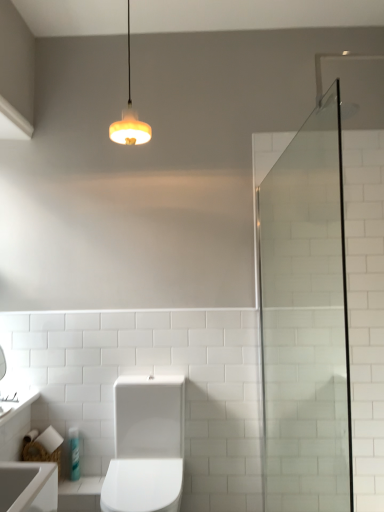
I want to click on white glossy sink at lower left, so click(19, 404).

What is the approximate width of clear glass shower door at right?

1.45 meters.

What do you see at coordinates (74, 454) in the screenshot? The width and height of the screenshot is (384, 512). I see `translucent plastic bottle at lower left` at bounding box center [74, 454].

Where is `matte yellow glass pendant light at upper center`? matte yellow glass pendant light at upper center is located at coordinates (130, 117).

Considering the positions of objects clear glass shower door at right and translucent plastic bottle at lower left in the image provided, who is more to the right, clear glass shower door at right or translucent plastic bottle at lower left?

Positioned to the right is clear glass shower door at right.

Who is taller, clear glass shower door at right or translucent plastic bottle at lower left?

Standing taller between the two is clear glass shower door at right.

Is translucent plastic bottle at lower left at the back of clear glass shower door at right?

No, clear glass shower door at right's orientation is not away from translucent plastic bottle at lower left.

Measure the distance from clear glass shower door at right to translucent plastic bottle at lower left.

clear glass shower door at right and translucent plastic bottle at lower left are 1.42 meters apart.

Is the surface of matte yellow glass pendant light at upper center in direct contact with white glossy toilet at center?

No, matte yellow glass pendant light at upper center is not making contact with white glossy toilet at center.

From a real-world perspective, is matte yellow glass pendant light at upper center physically located above or below white glossy toilet at center?

matte yellow glass pendant light at upper center is above white glossy toilet at center.

From the image's perspective, would you say matte yellow glass pendant light at upper center is shown under white glossy toilet at center?

No, from the image's perspective, matte yellow glass pendant light at upper center is not below white glossy toilet at center.

Where is `light fixture behind the white glossy toilet at center`? The image size is (384, 512). light fixture behind the white glossy toilet at center is located at coordinates (130, 117).

In the image, is matte yellow glass pendant light at upper center positioned in front of or behind clear glass shower door at right?

matte yellow glass pendant light at upper center is behind clear glass shower door at right.

Is matte yellow glass pendant light at upper center not near clear glass shower door at right?

matte yellow glass pendant light at upper center is positioned a significant distance from clear glass shower door at right.

Can you tell me how much matte yellow glass pendant light at upper center and clear glass shower door at right differ in facing direction?

0.273 degrees separate the facing orientations of matte yellow glass pendant light at upper center and clear glass shower door at right.

Is matte yellow glass pendant light at upper center facing towards clear glass shower door at right?

No, matte yellow glass pendant light at upper center is not oriented towards clear glass shower door at right.

Would you say white glossy toilet at center is a long distance from white glossy sink at lower left?

white glossy toilet at center is near white glossy sink at lower left, not far away.

Looking at this image, is white glossy toilet at center outside of white glossy sink at lower left?

white glossy toilet at center lies outside white glossy sink at lower left's area.

Between white glossy toilet at center and white glossy sink at lower left, which one has more height?

white glossy toilet at center is taller.

From the image's perspective, is white glossy toilet at center located beneath white glossy sink at lower left?

Answer: Correct, white glossy toilet at center appears lower than white glossy sink at lower left in the image.

Who is shorter, translucent plastic bottle at lower left or white glossy toilet at center?

With less height is translucent plastic bottle at lower left.

Is translucent plastic bottle at lower left positioned with its back to white glossy toilet at center?

That's not correct — translucent plastic bottle at lower left is not looking away from white glossy toilet at center.

Where is `toiletry behind the white glossy toilet at center`? Image resolution: width=384 pixels, height=512 pixels. toiletry behind the white glossy toilet at center is located at coordinates (74, 454).

Is translucent plastic bottle at lower left to the left of white glossy toilet at center from the viewer's perspective?

Yes.

Identify the location of screen door on the right of white glossy toilet at center. Image resolution: width=384 pixels, height=512 pixels. (306, 321).

Can you tell me how much white glossy toilet at center and clear glass shower door at right differ in facing direction?

There is a 1.71-degree angle between the facing directions of white glossy toilet at center and clear glass shower door at right.

Based on the photo, considering the sizes of objects white glossy toilet at center and clear glass shower door at right in the image provided, who is smaller, white glossy toilet at center or clear glass shower door at right?

clear glass shower door at right.

Is point (75, 469) positioned after point (324, 279)?

No, (75, 469) is in front of (324, 279).

Considering the sizes of translucent plastic bottle at lower left and clear glass shower door at right in the image, is translucent plastic bottle at lower left taller or shorter than clear glass shower door at right?

Clearly, translucent plastic bottle at lower left is shorter compared to clear glass shower door at right.

How many degrees apart are the facing directions of translucent plastic bottle at lower left and clear glass shower door at right?

There is a 2.39-degree angle between the facing directions of translucent plastic bottle at lower left and clear glass shower door at right.

Based on the photo, from the image's perspective, is translucent plastic bottle at lower left under clear glass shower door at right?

Yes.

At what (x,y) coordinates should I click in order to perform the action: click on screen door above the translucent plastic bottle at lower left (from the image's perspective). Please return your answer as a coordinate pair (x, y). The image size is (384, 512). Looking at the image, I should click on (306, 321).

The width and height of the screenshot is (384, 512). In order to click on toilet below the matte yellow glass pendant light at upper center (from a real-world perspective) in this screenshot , I will do `click(146, 445)`.

From the image, which object appears to be nearer to translucent plastic bottle at lower left, matte yellow glass pendant light at upper center or white glossy toilet at center?

Among the two, white glossy toilet at center is located nearer to translucent plastic bottle at lower left.

From the image, which object appears to be nearer to matte yellow glass pendant light at upper center, white glossy sink at lower left or translucent plastic bottle at lower left?

Based on the image, white glossy sink at lower left appears to be nearer to matte yellow glass pendant light at upper center.

Estimate the real-world distances between objects in this image. Which object is closer to clear glass shower door at right, matte yellow glass pendant light at upper center or translucent plastic bottle at lower left?

The object closer to clear glass shower door at right is matte yellow glass pendant light at upper center.

Looking at the image, which one is located further to translucent plastic bottle at lower left, white glossy sink at lower left or clear glass shower door at right?

clear glass shower door at right lies further to translucent plastic bottle at lower left than the other object.

From the image, which object appears to be farther from translucent plastic bottle at lower left, white glossy toilet at center or white glossy sink at lower left?

Based on the image, white glossy toilet at center appears to be further to translucent plastic bottle at lower left.

From the image, which object appears to be farther from white glossy toilet at center, matte yellow glass pendant light at upper center or white glossy sink at lower left?

matte yellow glass pendant light at upper center.

Looking at the image, which one is located further to white glossy sink at lower left, translucent plastic bottle at lower left or matte yellow glass pendant light at upper center?

matte yellow glass pendant light at upper center lies further to white glossy sink at lower left than the other object.

When comparing their distances from white glossy toilet at center, does white glossy sink at lower left or translucent plastic bottle at lower left seem closer?

translucent plastic bottle at lower left is positioned closer to the anchor white glossy toilet at center.

Identify the location of toilet between matte yellow glass pendant light at upper center and translucent plastic bottle at lower left in the up-down direction. The height and width of the screenshot is (512, 384). point(146,445).

Where is `counter top between matte yellow glass pendant light at upper center and translucent plastic bottle at lower left in the up-down direction`? This screenshot has height=512, width=384. counter top between matte yellow glass pendant light at upper center and translucent plastic bottle at lower left in the up-down direction is located at coordinates (19, 404).

At what (x,y) coordinates should I click in order to perform the action: click on toilet between clear glass shower door at right and translucent plastic bottle at lower left along the z-axis. Please return your answer as a coordinate pair (x, y). Looking at the image, I should click on (146, 445).

Locate an element on the screen. Image resolution: width=384 pixels, height=512 pixels. screen door between matte yellow glass pendant light at upper center and translucent plastic bottle at lower left from top to bottom is located at coordinates (306, 321).